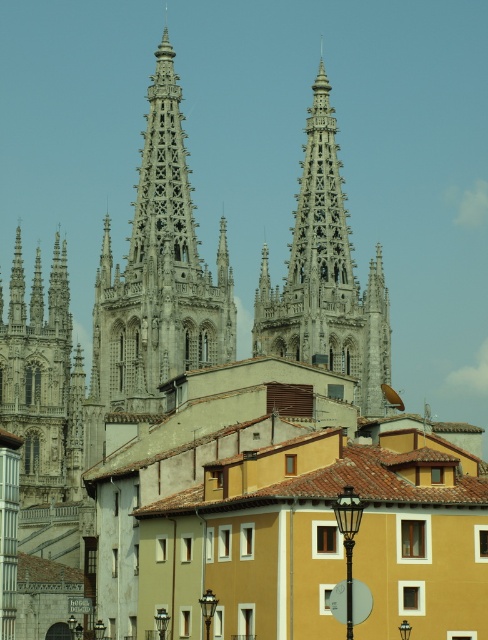
Question: Among these points, which one is nearest to the camera?

Choices:
 (A) (344, 328)
 (B) (155, 308)

Answer: (B)

Question: Does gray stone spire at center appear under gray stone tower at left?

Choices:
 (A) no
 (B) yes

Answer: (A)

Question: Where is gray stone spire at center located in relation to white stone spire at center in the image?

Choices:
 (A) left
 (B) right

Answer: (A)

Question: Considering the relative positions of gray stone spire at center and white stone spire at center in the image provided, where is gray stone spire at center located with respect to white stone spire at center?

Choices:
 (A) right
 (B) left

Answer: (B)

Question: Which point is farther to the camera?

Choices:
 (A) gray stone tower at left
 (B) gray stone spire at center

Answer: (A)

Question: Which object is positioned farthest from the gray stone tower at left?

Choices:
 (A) white stone spire at center
 (B) gray stone spire at center

Answer: (A)